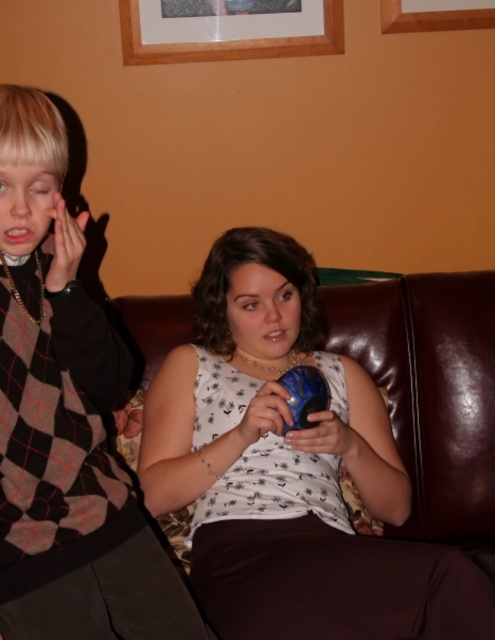
Question: Does checkered fabric sweater at left appear on the right side of wooden picture frame at upper center?

Choices:
 (A) no
 (B) yes

Answer: (A)

Question: Does checkered fabric sweater at left appear on the right side of wooden frame at upper center?

Choices:
 (A) no
 (B) yes

Answer: (A)

Question: Which point is closer to the camera?

Choices:
 (A) white fabric shirt at center
 (B) checkered fabric sweater at left
 (C) wooden frame at upper center
 (D) wooden picture frame at upper center

Answer: (B)

Question: Which of the following is the closest to the observer?

Choices:
 (A) white fabric shirt at center
 (B) wooden picture frame at upper center
 (C) checkered fabric sweater at left
 (D) wooden frame at upper center

Answer: (C)

Question: Among these objects, which one is nearest to the camera?

Choices:
 (A) wooden frame at upper center
 (B) white fabric shirt at center

Answer: (B)

Question: Considering the relative positions of checkered fabric sweater at left and wooden frame at upper center in the image provided, where is checkered fabric sweater at left located with respect to wooden frame at upper center?

Choices:
 (A) above
 (B) below

Answer: (B)